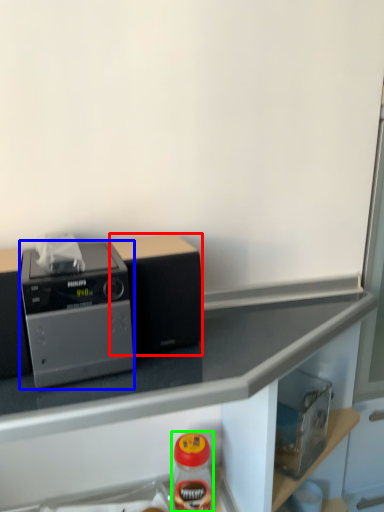
Question: Which object is positioned farthest from appliance (highlighted by a red box)? Select from home appliance (highlighted by a blue box) and bottle (highlighted by a green box).

Choices:
 (A) home appliance
 (B) bottle

Answer: (B)